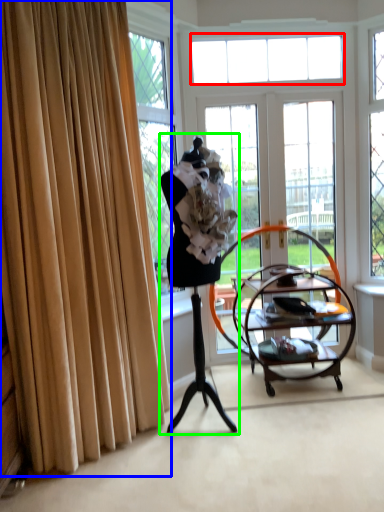
Question: Estimate the real-world distances between objects in this image. Which object is farther from window (highlighted by a red box), curtain (highlighted by a blue box) or woman (highlighted by a green box)?

Choices:
 (A) curtain
 (B) woman

Answer: (A)